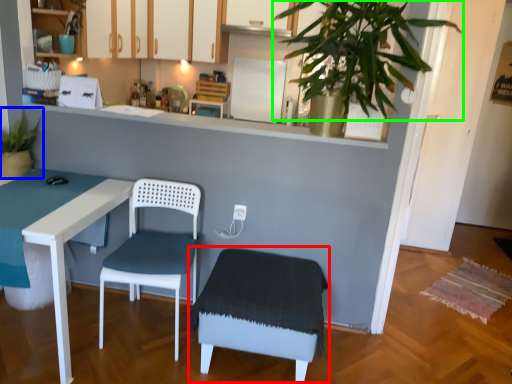
Question: Estimate the real-world distances between objects in this image. Which object is closer to step stool (highlighted by a red box), houseplant (highlighted by a blue box) or vegetation (highlighted by a green box)?

Choices:
 (A) houseplant
 (B) vegetation

Answer: (B)